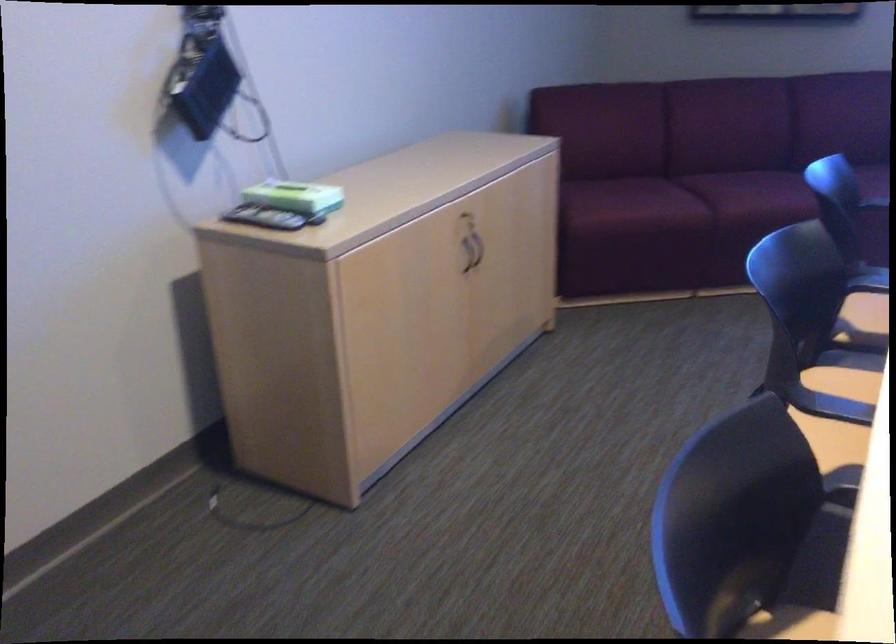
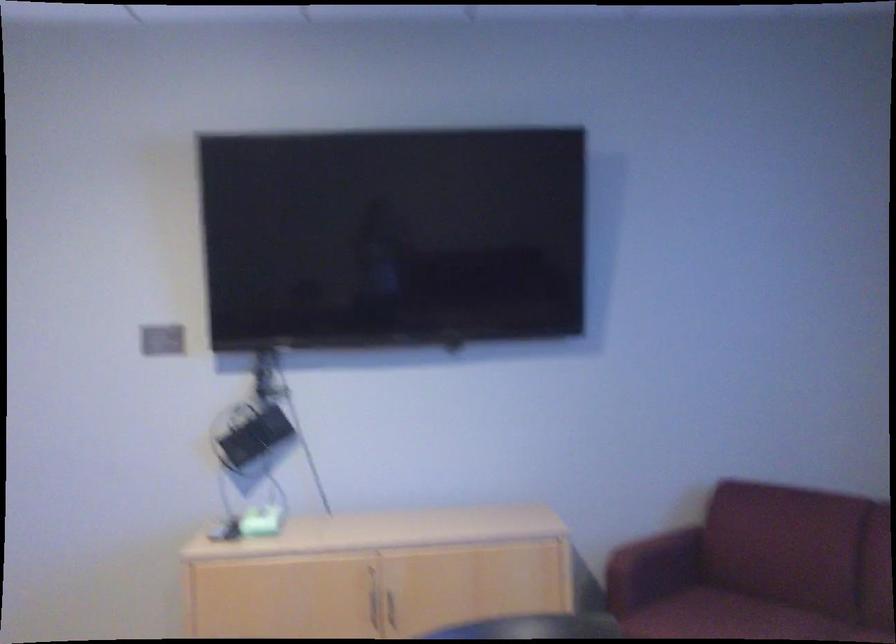
In the second image, find the point that corresponds to point 630,187 in the first image.

(722, 616)